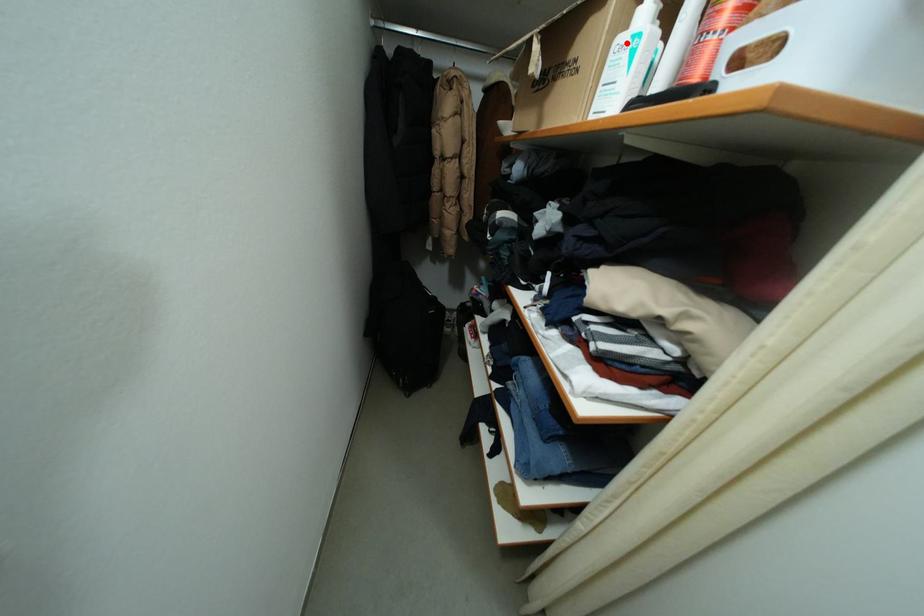
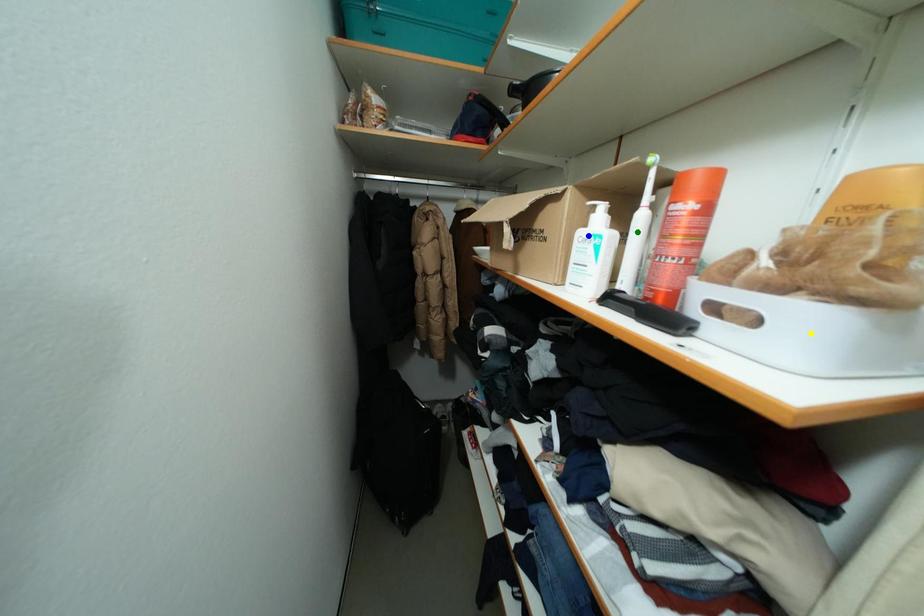
Question: I am providing you with two images of the same scene from different viewpoints. A red point is marked on the first image. You are given multiple points on the second image. Which point in image 2 is actually the same real-world point as the red point in image 1?

Choices:
 (A) blue point
 (B) green point
 (C) yellow point

Answer: (A)